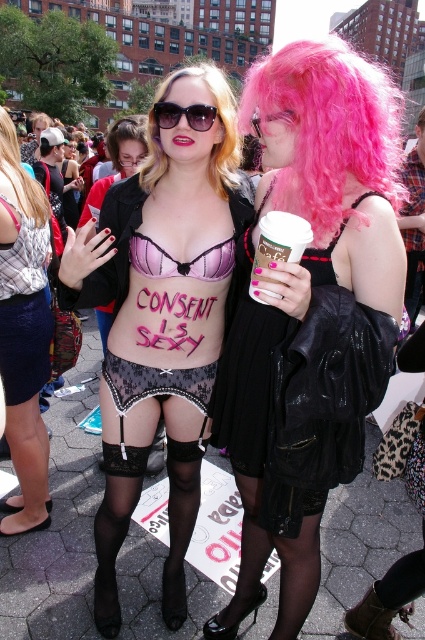
Question: Does blondehair at center lie behind white paper cup at center?

Choices:
 (A) yes
 (B) no

Answer: (A)

Question: Is matte black shorts at lower left thinner than pink synthetic wig at upper center?

Choices:
 (A) yes
 (B) no

Answer: (A)

Question: Which object appears farthest from the camera in this image?

Choices:
 (A) pink satin bikini top at center
 (B) lace-patterned black underwear at center
 (C) pink matte bra at center

Answer: (B)

Question: Which of these objects is positioned closest to the matte black shorts at lower left?

Choices:
 (A) blondehair at upper left
 (B) pink synthetic wig at upper center
 (C) white paper cup at center

Answer: (A)

Question: Observing the image, what is the correct spatial positioning of pink matte bra at center in reference to brown suede boot at lower right?

Choices:
 (A) above
 (B) below

Answer: (A)

Question: Which of these objects is positioned closest to the lace-patterned black underwear at center?

Choices:
 (A) sunglasses at center
 (B) blondehair at upper left

Answer: (B)